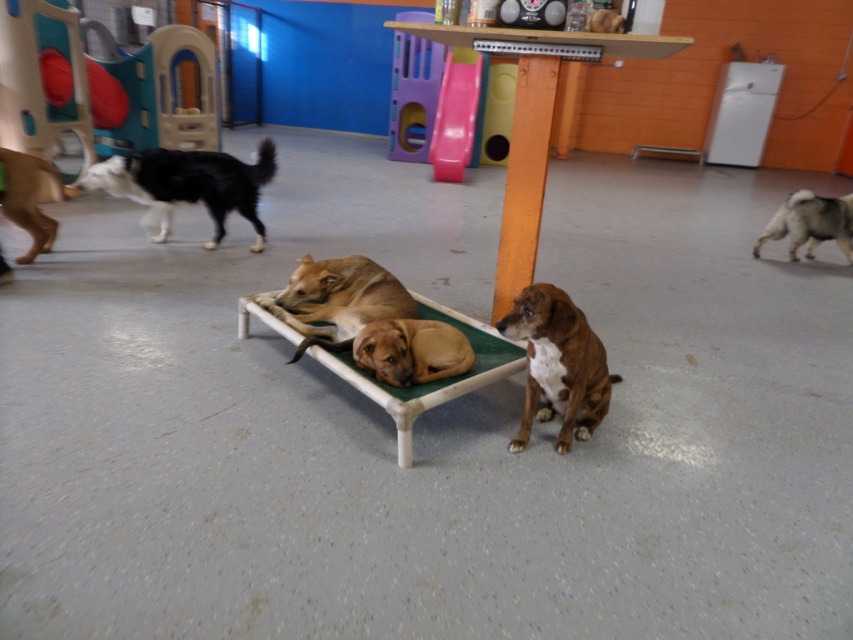
Question: Which point is farther to the camera?

Choices:
 (A) brown fur dog at left
 (B) green fabric dog bed at center
 (C) orange wood pillar at center
 (D) black and white fur at upper left

Answer: (D)

Question: Which object is closer to the camera taking this photo?

Choices:
 (A) gray fur dog at right
 (B) brown fur bed at center
 (C) brown matte dog at center

Answer: (C)

Question: Is orange wood pillar at center above brown fur dog at left?

Choices:
 (A) no
 (B) yes

Answer: (A)

Question: Which point is farther to the camera?

Choices:
 (A) (0, 172)
 (B) (503, 193)
 (C) (515, 365)

Answer: (B)

Question: Is gray fur dog at right bigger than brown fur dog at left?

Choices:
 (A) yes
 (B) no

Answer: (A)

Question: Considering the relative positions of black and white fur at upper left and orange wood pillar at center in the image provided, where is black and white fur at upper left located with respect to orange wood pillar at center?

Choices:
 (A) left
 (B) right

Answer: (A)